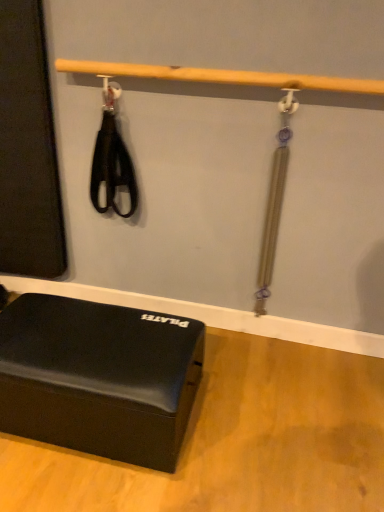
Question: Is matte black foam block at lower left turned away from wooden bar at upper center?

Choices:
 (A) yes
 (B) no

Answer: (B)

Question: Can you confirm if matte black foam block at lower left is taller than wooden bar at upper center?

Choices:
 (A) no
 (B) yes

Answer: (B)

Question: Is matte black foam block at lower left oriented towards wooden bar at upper center?

Choices:
 (A) yes
 (B) no

Answer: (B)

Question: Are matte black foam block at lower left and wooden bar at upper center far apart?

Choices:
 (A) yes
 (B) no

Answer: (B)

Question: Is the depth of matte black foam block at lower left greater than that of wooden bar at upper center?

Choices:
 (A) no
 (B) yes

Answer: (A)

Question: Is matte black foam block at lower left smaller than wooden bar at upper center?

Choices:
 (A) no
 (B) yes

Answer: (A)

Question: Would you say wooden bar at upper center is a long distance from matte black foam block at lower left?

Choices:
 (A) yes
 (B) no

Answer: (B)

Question: Can you confirm if wooden bar at upper center is positioned to the left of matte black foam block at lower left?

Choices:
 (A) yes
 (B) no

Answer: (B)

Question: From a real-world perspective, is wooden bar at upper center beneath matte black foam block at lower left?

Choices:
 (A) yes
 (B) no

Answer: (B)

Question: Is wooden bar at upper center bigger than matte black foam block at lower left?

Choices:
 (A) no
 (B) yes

Answer: (A)

Question: Considering the relative positions of wooden bar at upper center and matte black foam block at lower left in the image provided, is wooden bar at upper center behind matte black foam block at lower left?

Choices:
 (A) no
 (B) yes

Answer: (B)

Question: Does wooden bar at upper center have a lesser width compared to matte black foam block at lower left?

Choices:
 (A) no
 (B) yes

Answer: (B)

Question: In terms of width, does wooden bar at upper center look wider or thinner when compared to matte black foam block at lower left?

Choices:
 (A) thin
 (B) wide

Answer: (A)